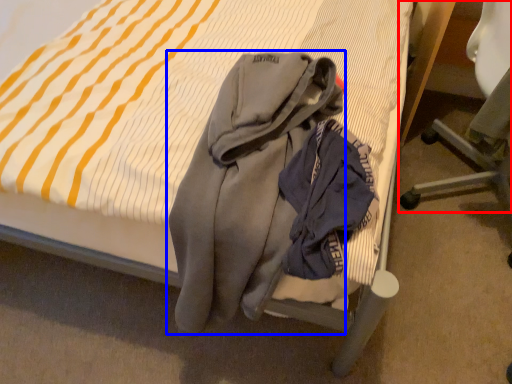
Question: Which of the following is the farthest to the observer, chair (highlighted by a red box) or garment (highlighted by a blue box)?

Choices:
 (A) chair
 (B) garment

Answer: (A)